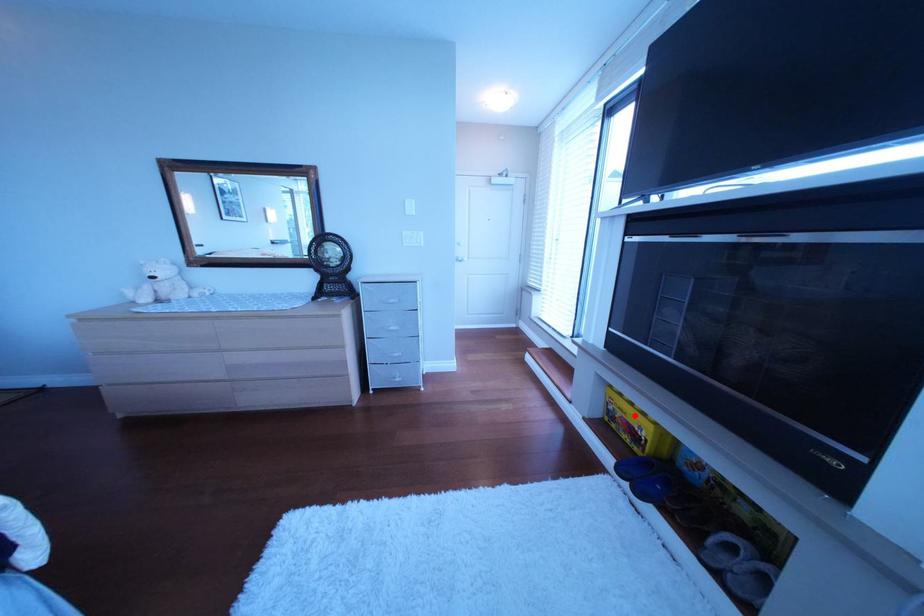
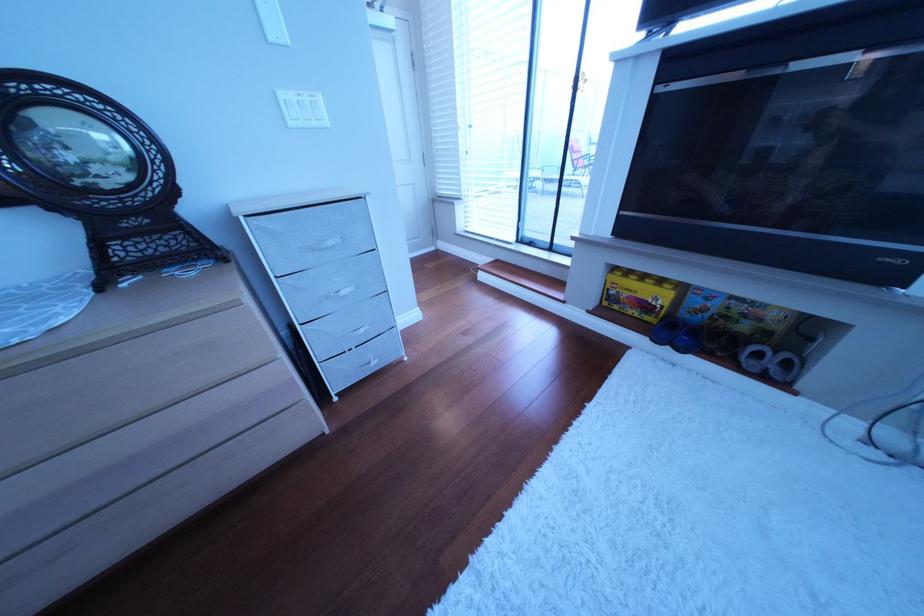
Locate, in the second image, the point that corresponds to the highlighted location in the first image.

(640, 296)